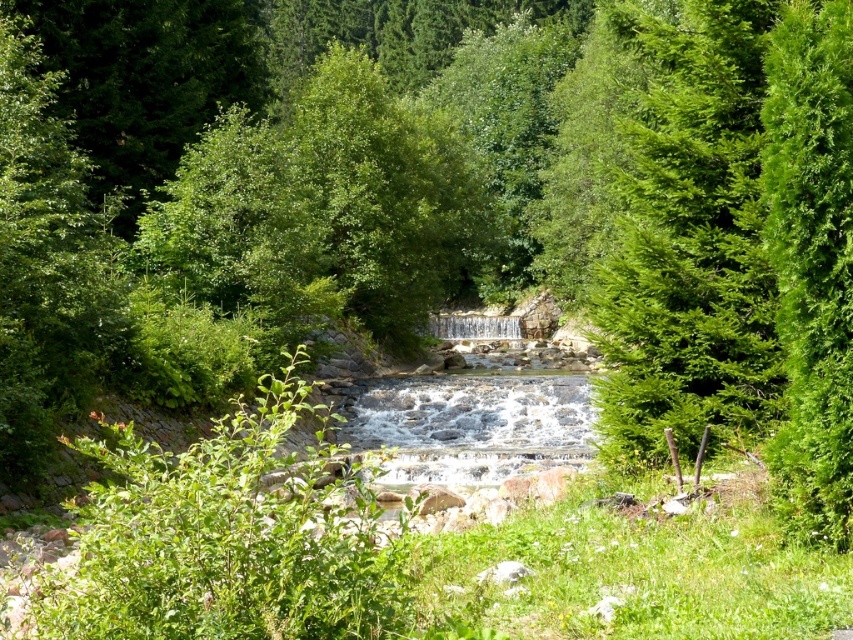
Question: Which of the following is the closest to the observer?

Choices:
 (A) (782, 230)
 (B) (619, 440)

Answer: (A)

Question: Does green leafy tree at right appear over green fluffy tree at right?

Choices:
 (A) no
 (B) yes

Answer: (B)

Question: Can you confirm if green leafy tree at right is thinner than green fluffy tree at right?

Choices:
 (A) yes
 (B) no

Answer: (B)

Question: Does green leafy tree at right have a smaller size compared to green fluffy tree at right?

Choices:
 (A) no
 (B) yes

Answer: (A)